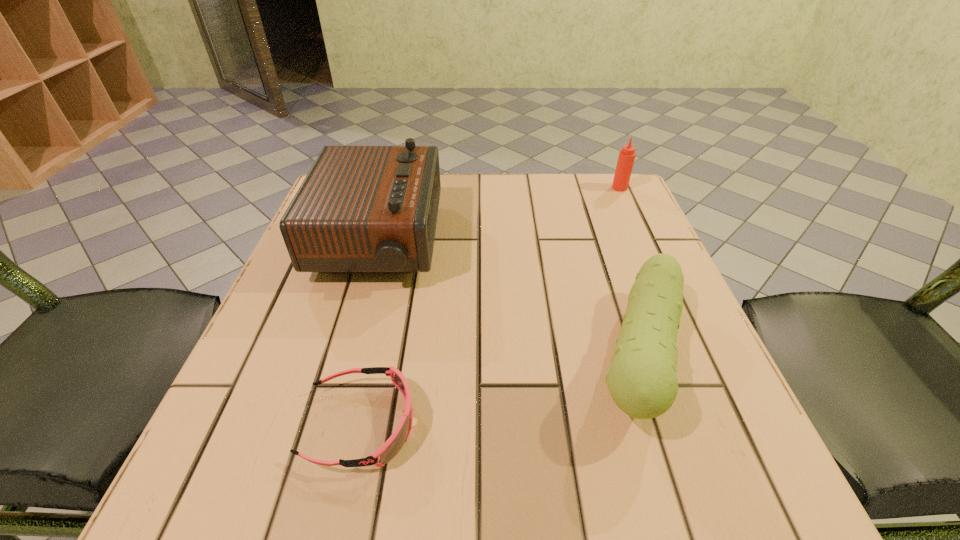
Where is `free space in the image that satisfies the following two spatial constraints: 1. on the front panel of the tallest object; 2. on the back side of the cucumber`? The image size is (960, 540). free space in the image that satisfies the following two spatial constraints: 1. on the front panel of the tallest object; 2. on the back side of the cucumber is located at coordinates click(x=346, y=356).

Find the location of `vacant space that satisfies the following two spatial constraints: 1. on the front side of the farthest object; 2. on the front-facing side of the goggles`. vacant space that satisfies the following two spatial constraints: 1. on the front side of the farthest object; 2. on the front-facing side of the goggles is located at coordinates tap(727, 424).